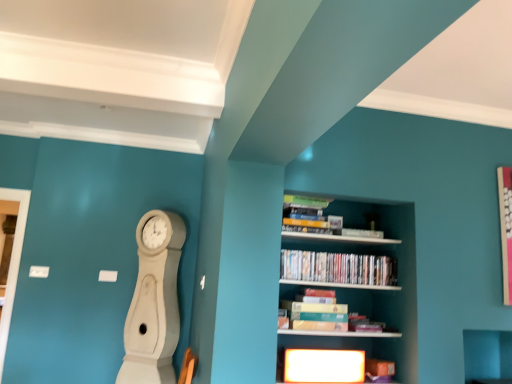
Question: Is matte cardboard book at center, placed as the second book when sorted from top to bottom, in front of or behind matte plastic dvds at center, placed as the first book when sorted from top to bottom, in the image?

Choices:
 (A) front
 (B) behind

Answer: (A)

Question: Would you say matte cardboard book at center, placed as the second book when sorted from top to bottom, is to the left or to the right of matte plastic dvds at center, acting as the second book starting from the bottom, in the picture?

Choices:
 (A) left
 (B) right

Answer: (A)

Question: Considering the real-world distances, which object is farthest from the matte plastic dvds at center, acting as the second book starting from the bottom?

Choices:
 (A) matte cardboard book at center, placed as the second book when sorted from top to bottom
 (B) wooden bookshelf at center
 (C) white wood clock at left

Answer: (C)

Question: Estimate the real-world distances between objects in this image. Which object is closer to the white wood clock at left?

Choices:
 (A) matte cardboard book at center, which appears as the first book when ordered from the bottom
 (B) matte plastic dvds at center, placed as the first book when sorted from top to bottom
 (C) wooden bookshelf at center

Answer: (A)